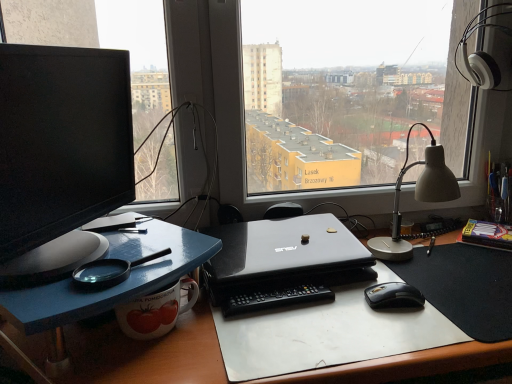
Question: Is matte black monitor at left positioned far away from black matte laptop at center?

Choices:
 (A) no
 (B) yes

Answer: (A)

Question: Is matte black monitor at left smaller than black matte laptop at center?

Choices:
 (A) yes
 (B) no

Answer: (B)

Question: Is matte black monitor at left taller than black matte laptop at center?

Choices:
 (A) no
 (B) yes

Answer: (B)

Question: Could you tell me if matte black monitor at left is turned towards black matte laptop at center?

Choices:
 (A) no
 (B) yes

Answer: (B)

Question: Is matte black monitor at left touching black matte laptop at center?

Choices:
 (A) no
 (B) yes

Answer: (A)

Question: Does point (310, 289) appear closer or farther from the camera than point (393, 304)?

Choices:
 (A) closer
 (B) farther

Answer: (B)

Question: Would you say black plastic remote control at center is to the left or to the right of black glossy mouse at lower right in the picture?

Choices:
 (A) right
 (B) left

Answer: (B)

Question: From their relative heights in the image, would you say black plastic remote control at center is taller or shorter than black glossy mouse at lower right?

Choices:
 (A) tall
 (B) short

Answer: (B)

Question: From a real-world perspective, is black plastic remote control at center positioned above or below black glossy mouse at lower right?

Choices:
 (A) below
 (B) above

Answer: (A)

Question: Which is correct: matte black monitor at left is inside white glossy desk at center, or outside of it?

Choices:
 (A) outside
 (B) inside

Answer: (A)

Question: Looking at their shapes, would you say matte black monitor at left is wider or thinner than white glossy desk at center?

Choices:
 (A) wide
 (B) thin

Answer: (B)

Question: From the image's perspective, is matte black monitor at left above or below white glossy desk at center?

Choices:
 (A) below
 (B) above

Answer: (B)

Question: Visually, is matte black monitor at left positioned to the left or to the right of white glossy desk at center?

Choices:
 (A) left
 (B) right

Answer: (A)

Question: Based on their sizes in the image, would you say white plastic notepad at right is bigger or smaller than white plastic table lamp at right?

Choices:
 (A) small
 (B) big

Answer: (A)

Question: From the image's perspective, relative to white plastic table lamp at right, is white plastic notepad at right above or below?

Choices:
 (A) below
 (B) above

Answer: (A)